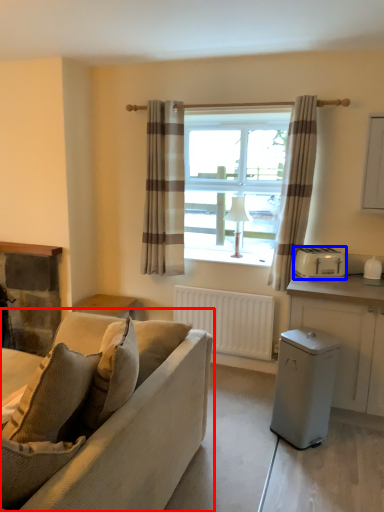
Question: Which object appears closest to the camera in this image, studio couch (highlighted by a red box) or appliance (highlighted by a blue box)?

Choices:
 (A) studio couch
 (B) appliance

Answer: (A)